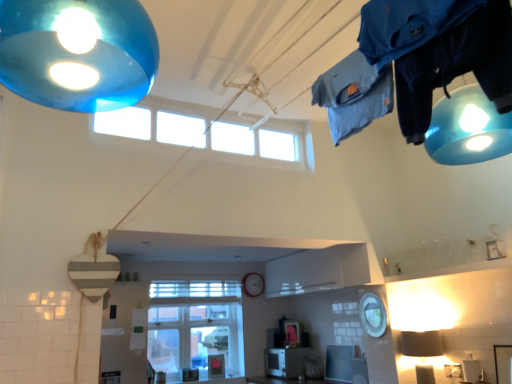
Identify the location of transparent glass window at upper center, placed as the first window when sorted from top to bottom. (209, 132).

Describe the element at coordinates (285, 362) in the screenshot. This screenshot has height=384, width=512. I see `satin silver toaster at center` at that location.

Identify the location of satin silver toaster at center. Image resolution: width=512 pixels, height=384 pixels. (285, 362).

I want to click on matte white lampshade at lower right, so click(421, 344).

I want to click on metallic silver clock at center, so click(253, 284).

Identify the location of transparent glass window at upper center, which ranks as the second window in back-to-front order. This screenshot has width=512, height=384. (209, 132).

The width and height of the screenshot is (512, 384). In order to click on clock below the transparent glass window at upper center, marked as the 1th window in a front-to-back arrangement (from the image's perspective) in this screenshot , I will do `click(253, 284)`.

Between transparent glass window at upper center, acting as the second window starting from the bottom, and metallic silver clock at center, which one has less height?

metallic silver clock at center.

Is metallic silver clock at center completely or partially inside transparent glass window at upper center, acting as the second window starting from the bottom?

No, metallic silver clock at center is not a part of transparent glass window at upper center, acting as the second window starting from the bottom.

From the image's perspective, which is below, transparent glass window at upper center, placed as the first window when sorted from top to bottom, or metallic silver clock at center?

metallic silver clock at center, from the image's perspective.

Which object is closer to the camera, metallic silver clock at center or satin silver toaster at center?

Positioned in front is satin silver toaster at center.

From the image's perspective, is metallic silver clock at center beneath satin silver toaster at center?

No, from the image's perspective, metallic silver clock at center is not below satin silver toaster at center.

Which object is positioned more to the right, metallic silver clock at center or satin silver toaster at center?

From the viewer's perspective, satin silver toaster at center appears more on the right side.

Is matte white lampshade at lower right at the right side of transparent glass window at upper center, which ranks as the second window in back-to-front order?

Yes.

Are matte white lampshade at lower right and transparent glass window at upper center, acting as the second window starting from the bottom, making contact?

matte white lampshade at lower right is not next to transparent glass window at upper center, acting as the second window starting from the bottom, and they're not touching.

Is matte white lampshade at lower right positioned with its back to transparent glass window at upper center, acting as the second window starting from the bottom?

matte white lampshade at lower right is not turned away from transparent glass window at upper center, acting as the second window starting from the bottom.

Considering the sizes of objects matte white lampshade at lower right and transparent glass window at upper center, which ranks as the second window in back-to-front order, in the image provided, who is bigger, matte white lampshade at lower right or transparent glass window at upper center, which ranks as the second window in back-to-front order,?

Bigger between the two is transparent glass window at upper center, which ranks as the second window in back-to-front order.

Can you tell me how much matte white lampshade at lower right and metallic silver clock at center differ in facing direction?

They differ by 88.8 degrees in their facing directions.

Is matte white lampshade at lower right inside the boundaries of metallic silver clock at center, or outside?

matte white lampshade at lower right cannot be found inside metallic silver clock at center.

Is point (426, 332) in front of point (260, 292)?

Yes.

Looking at this image, considering the relative sizes of satin silver toaster at center and matte white lampshade at lower right in the image provided, is satin silver toaster at center smaller than matte white lampshade at lower right?

No.

Which object is thinner, satin silver toaster at center or matte white lampshade at lower right?

matte white lampshade at lower right is thinner.

Is satin silver toaster at center to the left of matte white lampshade at lower right from the viewer's perspective?

Yes.

From the image's perspective, relative to matte white lampshade at lower right, is satin silver toaster at center above or below?

satin silver toaster at center is situated lower than matte white lampshade at lower right in the image.

Consider the image. Is matte white lampshade at lower right located outside clear glass window at center, the 2th window positioned from the front?

Yes, matte white lampshade at lower right is located beyond the bounds of clear glass window at center, the 2th window positioned from the front.

Consider the image. Which is more to the left, matte white lampshade at lower right or clear glass window at center, which is the 1th window in bottom-to-top order?

From the viewer's perspective, clear glass window at center, which is the 1th window in bottom-to-top order, appears more on the left side.

From a real-world perspective, is clear glass window at center, the first window in the back-to-front sequence, beneath metallic silver clock at center?

Yes, from a real-world perspective, clear glass window at center, the first window in the back-to-front sequence, is under metallic silver clock at center.

Between clear glass window at center, which is the 1th window in bottom-to-top order, and metallic silver clock at center, which one appears on the right side from the viewer's perspective?

metallic silver clock at center.

Considering the sizes of objects clear glass window at center, placed as the second window when sorted from top to bottom, and metallic silver clock at center in the image provided, who is smaller, clear glass window at center, placed as the second window when sorted from top to bottom, or metallic silver clock at center?

metallic silver clock at center is smaller.

Consider the image. Who is taller, clear glass window at center, placed as the second window when sorted from top to bottom, or metallic silver clock at center?

clear glass window at center, placed as the second window when sorted from top to bottom.

This screenshot has width=512, height=384. Identify the location of the 1st window counting from the left of the metallic silver clock at center. (209, 132).

Where is `appliance on the right of the metallic silver clock at center`? appliance on the right of the metallic silver clock at center is located at coordinates (285, 362).

Based on their spatial positions, is matte white lampshade at lower right or satin silver toaster at center closer to transparent glass window at upper center, placed as the first window when sorted from top to bottom?

matte white lampshade at lower right lies closer to transparent glass window at upper center, placed as the first window when sorted from top to bottom, than the other object.

Which object lies nearer to the anchor point transparent glass window at upper center, placed as the first window when sorted from top to bottom, satin silver toaster at center or clear glass window at center, placed as the second window when sorted from top to bottom?

The object closer to transparent glass window at upper center, placed as the first window when sorted from top to bottom, is clear glass window at center, placed as the second window when sorted from top to bottom.

Considering their positions, is satin silver toaster at center positioned closer to matte white lampshade at lower right than transparent glass window at upper center, marked as the 1th window in a front-to-back arrangement?

Based on the image, satin silver toaster at center appears to be nearer to matte white lampshade at lower right.

Which object lies nearer to the anchor point clear glass window at center, the 2th window positioned from the front, metallic silver clock at center or satin silver toaster at center?

metallic silver clock at center is closer to clear glass window at center, the 2th window positioned from the front.

Estimate the real-world distances between objects in this image. Which object is closer to metallic silver clock at center, transparent glass window at upper center, which ranks as the second window in back-to-front order, or matte white lampshade at lower right?

Based on the image, matte white lampshade at lower right appears to be nearer to metallic silver clock at center.

From the image, which object appears to be farther from matte white lampshade at lower right, transparent glass window at upper center, placed as the first window when sorted from top to bottom, or satin silver toaster at center?

The object further to matte white lampshade at lower right is transparent glass window at upper center, placed as the first window when sorted from top to bottom.

Based on the photo, which object lies further to the anchor point transparent glass window at upper center, marked as the 1th window in a front-to-back arrangement, satin silver toaster at center or matte white lampshade at lower right?

satin silver toaster at center lies further to transparent glass window at upper center, marked as the 1th window in a front-to-back arrangement, than the other object.

When comparing their distances from transparent glass window at upper center, acting as the second window starting from the bottom, does matte white lampshade at lower right or clear glass window at center, the first window in the back-to-front sequence, seem further?

clear glass window at center, the first window in the back-to-front sequence, is positioned further to the anchor transparent glass window at upper center, acting as the second window starting from the bottom.

At what (x,y) coordinates should I click in order to perform the action: click on clock between transparent glass window at upper center, acting as the second window starting from the bottom, and satin silver toaster at center in the up-down direction. Please return your answer as a coordinate pair (x, y). The image size is (512, 384). Looking at the image, I should click on (253, 284).

Locate an element on the screen. Image resolution: width=512 pixels, height=384 pixels. window between transparent glass window at upper center, marked as the 1th window in a front-to-back arrangement, and metallic silver clock at center in the front-back direction is located at coordinates (195, 326).

Identify the location of lamp between transparent glass window at upper center, which ranks as the second window in back-to-front order, and clear glass window at center, placed as the second window when sorted from top to bottom, in the vertical direction. (421, 344).

At what (x,y) coordinates should I click in order to perform the action: click on lamp between transparent glass window at upper center, marked as the 1th window in a front-to-back arrangement, and satin silver toaster at center vertically. Please return your answer as a coordinate pair (x, y). This screenshot has height=384, width=512. Looking at the image, I should click on (421, 344).